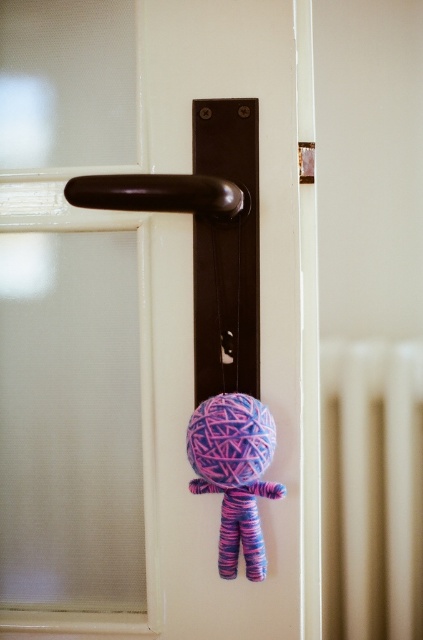
You need to determine if the matte brown handle at center can support the weight of an average smartphone. The knitted yarn doll at center is currently hanging from it. What should you consider about the handle and the doll?

The matte brown handle at center is bigger than the knitted yarn doll at center, but the description does not provide information about their weight capacity or the handle material. You should check if the handle is sturdy enough and if the yarn doll is securely attached before placing a smartphone on it.

You are a person with an arm length of 70 centimeters. You want to reach the matte brown handle at center. Can you reach it?

The matte brown handle at center is 75.41 centimeters away from the viewer. Since your arm length is 70 centimeters, you cannot reach it.

You are trying to determine which object is taller between the matte brown handle at center and the beige matte radiator at right. Based on the scene description, which one is taller?

The matte brown handle at center is taller than the beige matte radiator at right according to the description.